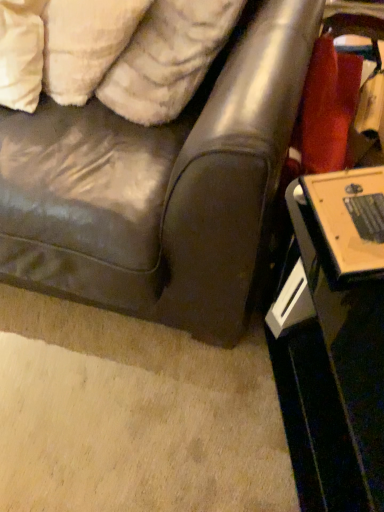
Question: Could white fluffy pillow at upper left, which is the 1th pillow in left-to-right order, be considered to be inside leather couch at center?

Choices:
 (A) yes
 (B) no

Answer: (A)

Question: From a real-world perspective, is leather couch at center physically below white fluffy pillow at upper left, which ranks as the 2th pillow in right-to-left order?

Choices:
 (A) no
 (B) yes

Answer: (B)

Question: Is leather couch at center smaller than white fluffy pillow at upper left, which ranks as the 2th pillow in right-to-left order?

Choices:
 (A) no
 (B) yes

Answer: (A)

Question: From the image's perspective, is leather couch at center located beneath white fluffy pillow at upper left, which is the 1th pillow in left-to-right order?

Choices:
 (A) yes
 (B) no

Answer: (A)

Question: Does leather couch at center lie behind white fluffy pillow at upper left, which ranks as the 2th pillow in right-to-left order?

Choices:
 (A) yes
 (B) no

Answer: (B)

Question: Can you confirm if leather couch at center is thinner than white fluffy pillow at upper left, which is the 1th pillow in left-to-right order?

Choices:
 (A) no
 (B) yes

Answer: (A)

Question: From the image's perspective, is leather couch at center under black glossy table at lower right?

Choices:
 (A) yes
 (B) no

Answer: (B)

Question: From the image's perspective, is leather couch at center on top of black glossy table at lower right?

Choices:
 (A) no
 (B) yes

Answer: (B)

Question: Can you confirm if leather couch at center is thinner than black glossy table at lower right?

Choices:
 (A) no
 (B) yes

Answer: (A)

Question: Does leather couch at center appear on the left side of black glossy table at lower right?

Choices:
 (A) yes
 (B) no

Answer: (A)

Question: From a real-world perspective, is leather couch at center physically below black glossy table at lower right?

Choices:
 (A) no
 (B) yes

Answer: (A)

Question: Is black glossy table at lower right completely or partially inside leather couch at center?

Choices:
 (A) yes
 (B) no

Answer: (B)

Question: Is white fluffy pillow at upper left, which is the 1th pillow in right-to-left order, to the right of black glossy table at lower right from the viewer's perspective?

Choices:
 (A) yes
 (B) no

Answer: (B)